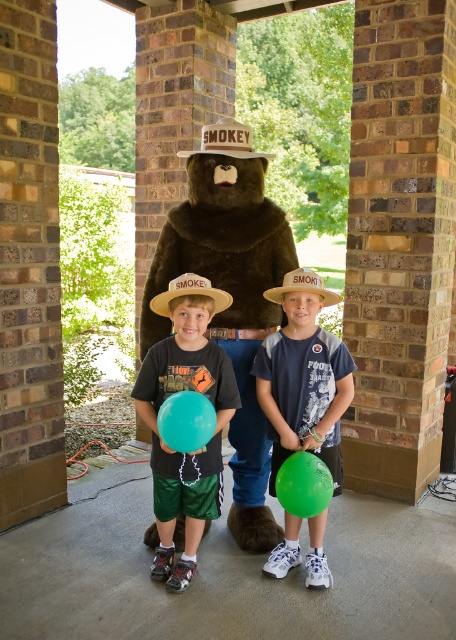
Consider the image. Does brown cardboard cowboy hat at center have a lesser width compared to brown straw hat at center?

No.

Between brown cardboard cowboy hat at center and brown straw hat at center, which one appears on the right side from the viewer's perspective?

From the viewer's perspective, brown cardboard cowboy hat at center appears more on the right side.

Does point (222, 120) come behind point (181, 284)?

Yes, point (222, 120) is farther from viewer.

The image size is (456, 640). What are the coordinates of `brown cardboard cowboy hat at center` in the screenshot? It's located at (227, 140).

Does green matte balloon at center appear on the left side of brown straw hat at center?

In fact, green matte balloon at center is to the right of brown straw hat at center.

Between point (310, 314) and point (196, 278), which one is positioned behind?

Positioned behind is point (310, 314).

Between point (269, 566) and point (208, 291), which one is positioned behind?

Positioned behind is point (269, 566).

The height and width of the screenshot is (640, 456). In order to click on green matte balloon at center in this screenshot , I will do pos(304,376).

Which is more to the left, matte black balloon at center or brown cardboard cowboy hat at center?

From the viewer's perspective, matte black balloon at center appears more on the left side.

Is point (231, 364) farther from viewer compared to point (203, 131)?

No, (231, 364) is closer to viewer.

Image resolution: width=456 pixels, height=640 pixels. I want to click on matte black balloon at center, so coord(200,445).